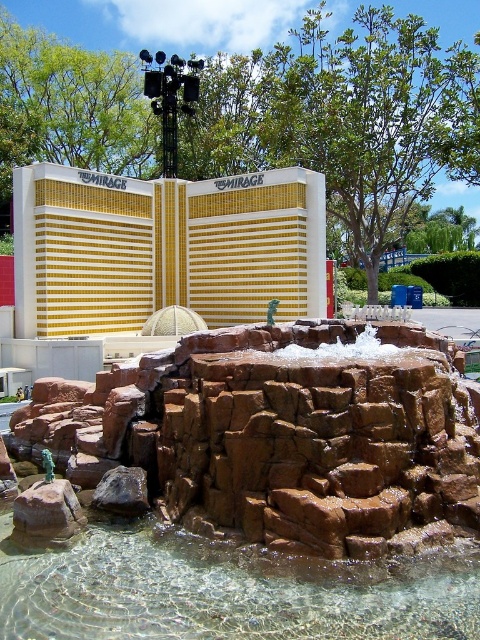
Question: Which object appears closest to the camera in this image?

Choices:
 (A) gold mosaic hotel at center
 (B) clear glass water at center

Answer: (B)

Question: Which object appears closest to the camera in this image?

Choices:
 (A) gold mosaic hotel at center
 (B) clear glass water at center

Answer: (B)

Question: Is gold mosaic hotel at center positioned behind clear glass water at center?

Choices:
 (A) no
 (B) yes

Answer: (B)

Question: Does gold mosaic hotel at center have a smaller size compared to clear glass water at center?

Choices:
 (A) no
 (B) yes

Answer: (A)

Question: Can you confirm if gold mosaic hotel at center is bigger than clear glass water at center?

Choices:
 (A) yes
 (B) no

Answer: (A)